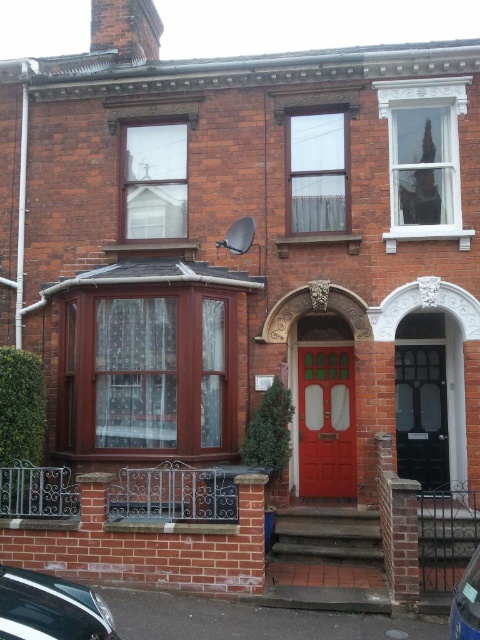
Question: Which point is farther to the camera?

Choices:
 (A) (0, 616)
 (B) (428, 376)
 (C) (453, 604)

Answer: (B)

Question: Does black textured door at center appear on the left side of shiny black car at lower left?

Choices:
 (A) yes
 (B) no

Answer: (B)

Question: Is black textured door at center wider than blue metallic car at lower right?

Choices:
 (A) yes
 (B) no

Answer: (A)

Question: Which object is positioned farthest from the blue metallic car at lower right?

Choices:
 (A) matte red door at center
 (B) black textured door at center
 (C) shiny black car at lower left

Answer: (A)

Question: Which object is the closest to the blue metallic car at lower right?

Choices:
 (A) shiny black car at lower left
 (B) matte red door at center
 (C) black textured door at center

Answer: (A)

Question: Can you confirm if matte red door at center is positioned to the left of shiny black car at lower left?

Choices:
 (A) yes
 (B) no

Answer: (B)